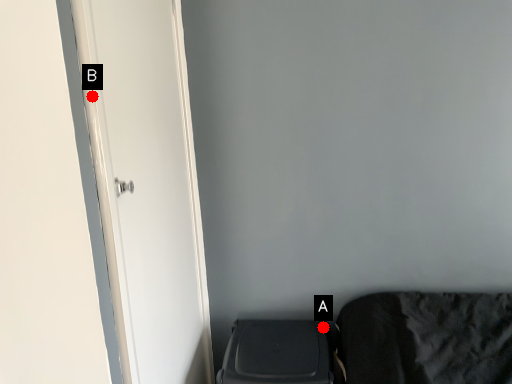
Question: Two points are circled on the image, labeled by A and B beside each circle. Which point is closer to the camera?

Choices:
 (A) A is closer
 (B) B is closer

Answer: (B)